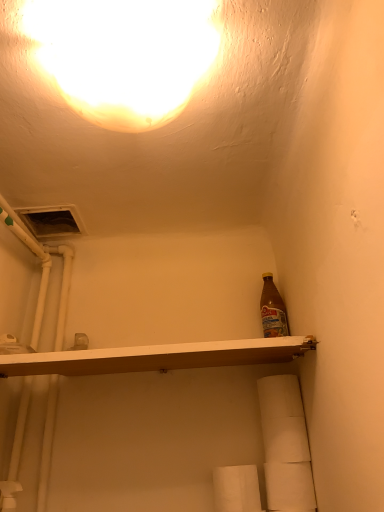
Question: Considering the positions of point (273, 407) and point (273, 489), is point (273, 407) closer or farther from the camera than point (273, 489)?

Choices:
 (A) farther
 (B) closer

Answer: (A)

Question: In terms of width, does white matte toilet paper at lower right, the 4th toilet paper positioned from the bottom, look wider or thinner when compared to white matte toilet paper at lower right, which is the 3th toilet paper in top-to-bottom order?

Choices:
 (A) wide
 (B) thin

Answer: (A)

Question: Estimate the real-world distances between objects in this image. Which object is farther from the matte yellow light at upper center?

Choices:
 (A) white matte toilet paper at lower right, marked as the first toilet paper in a top-to-bottom arrangement
 (B) white wood shelf at center
 (C) white matte toilet paper at lower right, which is the 3th toilet paper in top-to-bottom order
 (D) white paper towel at lower center, the first toilet paper positioned from the bottom
 (E) white matte toilet paper at lower right, which is the 2th toilet paper in top-to-bottom order

Answer: (C)

Question: Estimate the real-world distances between objects in this image. Which object is farther from the matte yellow light at upper center?

Choices:
 (A) white matte toilet paper at lower right, the 4th toilet paper positioned from the bottom
 (B) white paper towel at lower center, placed as the fourth toilet paper when sorted from top to bottom
 (C) white matte toilet paper at lower right, which is the 3th toilet paper in top-to-bottom order
 (D) white wood shelf at center
 (E) white matte toilet paper at lower right, which is the third toilet paper in bottom-to-top order

Answer: (C)